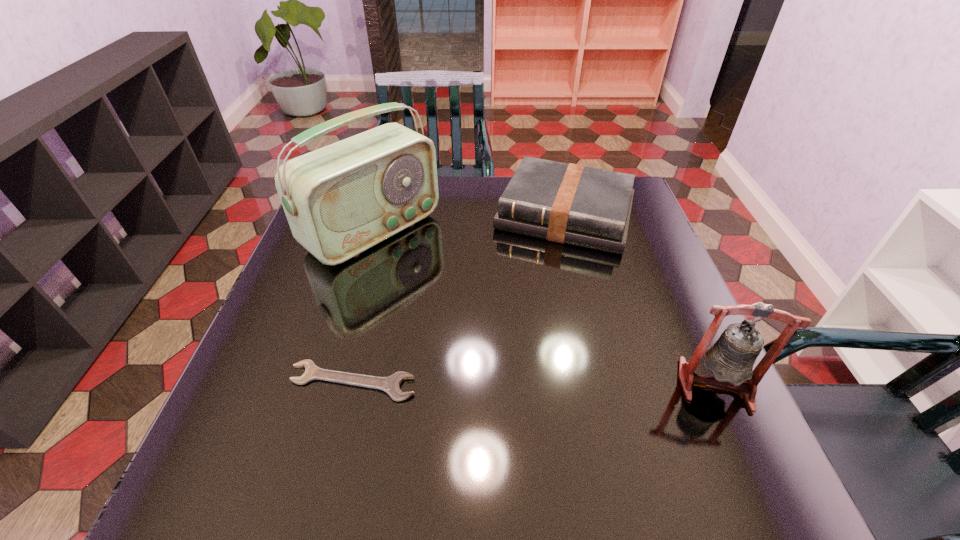
Locate an element on the screen. vacant space located on the spine side of the third tallest object is located at coordinates (539, 285).

Locate an element on the screen. Image resolution: width=960 pixels, height=540 pixels. vacant space situated 0.100m on the spine side of the third tallest object is located at coordinates (540, 279).

Locate an element on the screen. Image resolution: width=960 pixels, height=540 pixels. radio receiver situated at the far edge is located at coordinates (342, 199).

I want to click on hardback book situated at the far edge, so click(568, 203).

Identify the location of wrench positioned at the near edge. (391, 385).

Find the location of a particular element. bell located in the near edge section of the desktop is located at coordinates (731, 358).

Find the location of a particular element. wrench at the left edge is located at coordinates (391, 385).

Identify the location of radio receiver at the left edge. (342, 199).

This screenshot has height=540, width=960. Identify the location of bell located at the right edge. (731, 358).

You are a GUI agent. You are given a task and a screenshot of the screen. Output one action in this format:
    pyautogui.click(x=<x>, y=<y>)
    Task: Click on the hardback book at the right edge
    This screenshot has height=540, width=960.
    Given the screenshot: What is the action you would take?
    pyautogui.click(x=568, y=203)